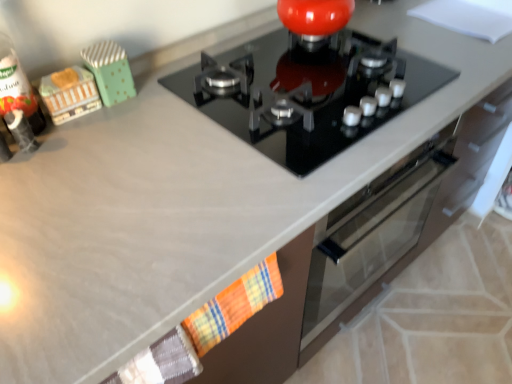
Question: Is black glass gas stove at center wider than wooden toy train at left, marked as the second toy in a right-to-left arrangement?

Choices:
 (A) no
 (B) yes

Answer: (B)

Question: Would you consider black glass gas stove at center to be distant from wooden toy train at left, the 1th toy positioned from the left?

Choices:
 (A) no
 (B) yes

Answer: (A)

Question: Considering the relative sizes of black glass gas stove at center and wooden toy train at left, marked as the second toy in a right-to-left arrangement, in the image provided, is black glass gas stove at center taller than wooden toy train at left, marked as the second toy in a right-to-left arrangement,?

Choices:
 (A) no
 (B) yes

Answer: (A)

Question: Is black glass gas stove at center outside of wooden toy train at left, marked as the second toy in a right-to-left arrangement?

Choices:
 (A) yes
 (B) no

Answer: (A)

Question: From a real-world perspective, is black glass gas stove at center on wooden toy train at left, the 1th toy positioned from the left?

Choices:
 (A) no
 (B) yes

Answer: (A)

Question: Is black glass gas stove at center positioned with its back to wooden toy train at left, marked as the second toy in a right-to-left arrangement?

Choices:
 (A) no
 (B) yes

Answer: (A)

Question: Considering the relative sizes of plaid fabric hand towel at lower center and wooden toy train at left, the 1th toy positioned from the left, in the image provided, is plaid fabric hand towel at lower center thinner than wooden toy train at left, the 1th toy positioned from the left,?

Choices:
 (A) no
 (B) yes

Answer: (B)

Question: From the image's perspective, is plaid fabric hand towel at lower center above wooden toy train at left, marked as the second toy in a right-to-left arrangement?

Choices:
 (A) no
 (B) yes

Answer: (A)

Question: From a real-world perspective, is plaid fabric hand towel at lower center on top of wooden toy train at left, the 1th toy positioned from the left?

Choices:
 (A) no
 (B) yes

Answer: (A)

Question: Is plaid fabric hand towel at lower center directly adjacent to wooden toy train at left, the 1th toy positioned from the left?

Choices:
 (A) no
 (B) yes

Answer: (A)

Question: Can you confirm if plaid fabric hand towel at lower center is positioned to the right of wooden toy train at left, the 1th toy positioned from the left?

Choices:
 (A) yes
 (B) no

Answer: (A)

Question: Is the position of plaid fabric hand towel at lower center more distant than that of wooden toy train at left, marked as the second toy in a right-to-left arrangement?

Choices:
 (A) yes
 (B) no

Answer: (B)

Question: Is plaid fabric hand towel at lower center shorter than black glass gas stove at center?

Choices:
 (A) no
 (B) yes

Answer: (A)